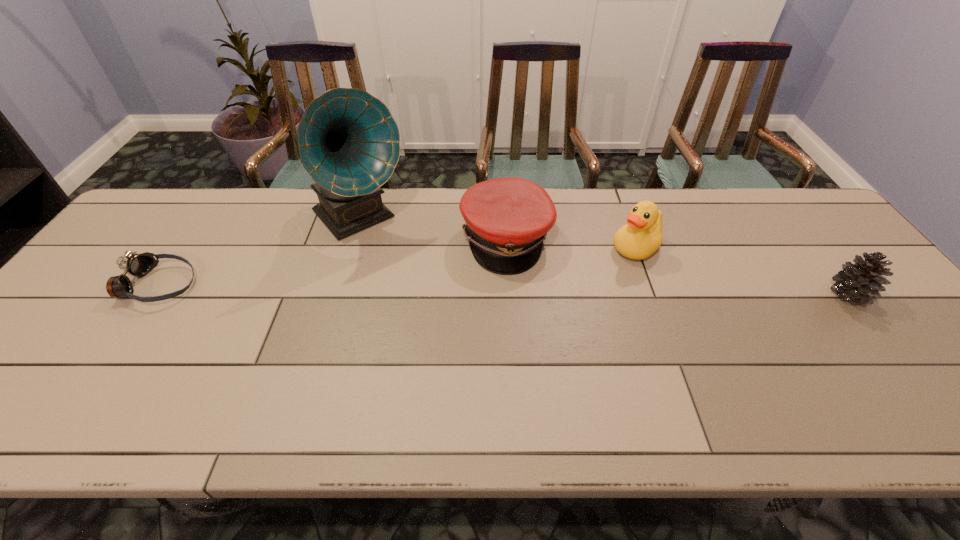
This screenshot has width=960, height=540. In the image, there is a desktop. What are the coordinates of `free space at the near right corner` in the screenshot? It's located at (936, 389).

Identify the location of vacant space that's between the cap and the pinecone. The height and width of the screenshot is (540, 960). (678, 267).

Locate an element on the screen. This screenshot has width=960, height=540. free space between the second object from left to right and the pinecone is located at coordinates (605, 256).

Find the location of a particular element. This screenshot has height=540, width=960. free space between the third object from left to right and the leftmost object is located at coordinates (332, 262).

You are a GUI agent. You are given a task and a screenshot of the screen. Output one action in this format:
    pyautogui.click(x=<x>, y=<y>)
    Task: Click on the vacant region between the shortest object and the tallest object
    Image resolution: width=960 pixels, height=540 pixels.
    Given the screenshot: What is the action you would take?
    pyautogui.click(x=259, y=252)

You are a GUI agent. You are given a task and a screenshot of the screen. Output one action in this format:
    pyautogui.click(x=<x>, y=<y>)
    Task: Click on the vacant area that lies between the rightmost object and the goggles
    The height and width of the screenshot is (540, 960).
    Given the screenshot: What is the action you would take?
    pyautogui.click(x=504, y=289)

Identify the location of free area in between the second object from left to right and the cap. The height and width of the screenshot is (540, 960). (433, 230).

Where is `empty space between the phonograph_record and the rightmost object`? The height and width of the screenshot is (540, 960). empty space between the phonograph_record and the rightmost object is located at coordinates [605, 256].

At what (x,y) coordinates should I click in order to perform the action: click on unoccupied position between the fourth object from right to left and the cap. Please return your answer as a coordinate pair (x, y). The height and width of the screenshot is (540, 960). Looking at the image, I should click on (433, 230).

Find the location of a particular element. The image size is (960, 540). free space between the leftmost object and the third object from right to left is located at coordinates (332, 262).